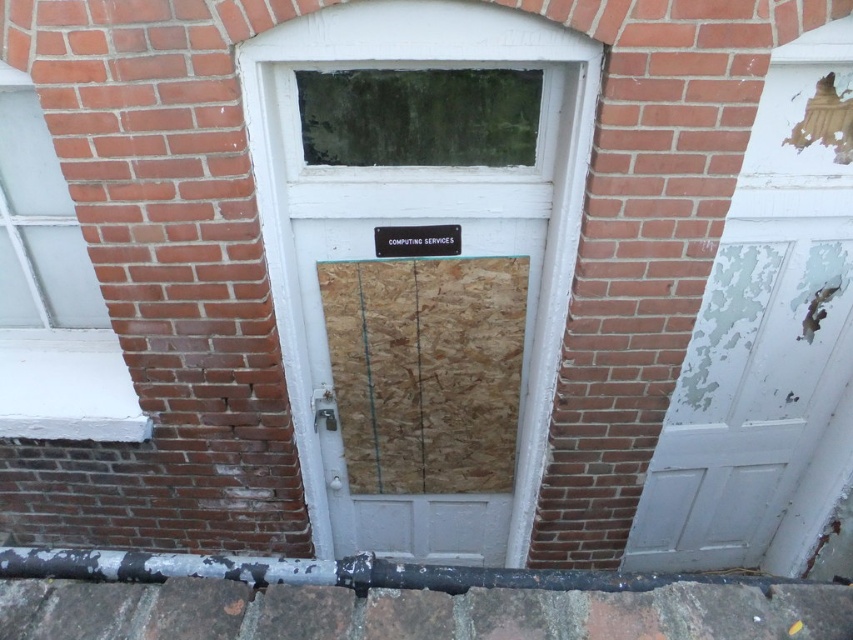
Question: Observing the image, what is the correct spatial positioning of white peeling paint door at right in reference to white painted glass at left?

Choices:
 (A) left
 (B) right

Answer: (B)

Question: Which point is closer to the camera?

Choices:
 (A) (432, 253)
 (B) (16, 424)
 (C) (815, 248)

Answer: (A)

Question: Does white painted glass at left have a greater width compared to black plastic sign at center?

Choices:
 (A) no
 (B) yes

Answer: (B)

Question: Considering the relative positions of white peeling paint door at right and white painted glass at left in the image provided, where is white peeling paint door at right located with respect to white painted glass at left?

Choices:
 (A) right
 (B) left

Answer: (A)

Question: Among these objects, which one is farthest from the camera?

Choices:
 (A) white painted glass at left
 (B) black plastic sign at center
 (C) white peeling paint door at right

Answer: (B)

Question: Which point is closer to the camera taking this photo?

Choices:
 (A) (801, 122)
 (B) (27, 168)

Answer: (A)